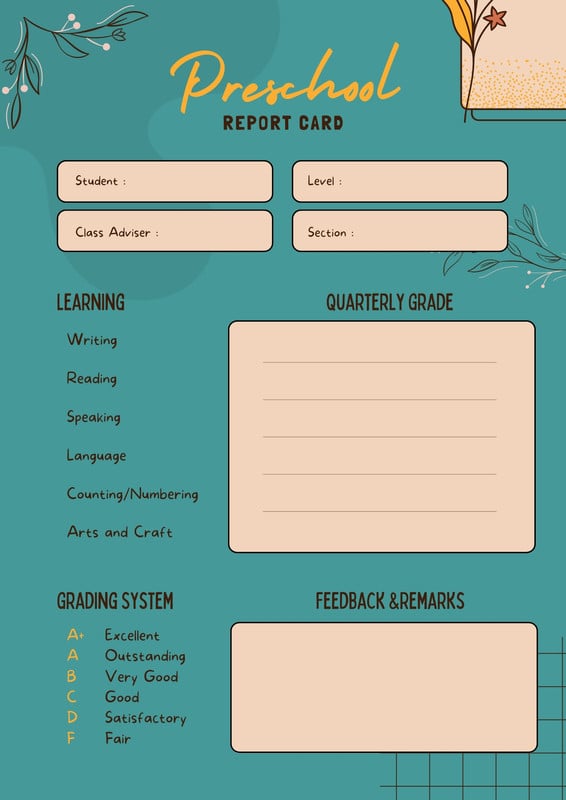
The width and height of the screenshot is (566, 800). Identify the location of box. (371, 186).